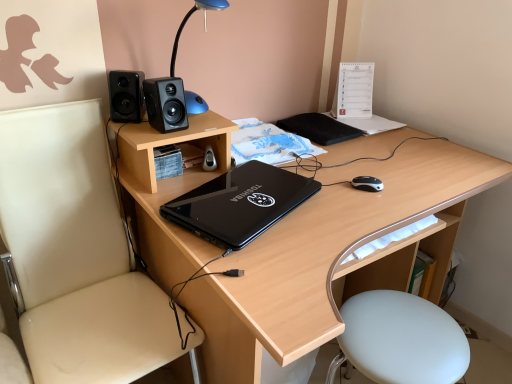
The width and height of the screenshot is (512, 384). Describe the element at coordinates (187, 20) in the screenshot. I see `blue glossy table lamp at upper center` at that location.

Identify the location of black plastic mouse at right. (367, 183).

What do you see at coordinates (400, 340) in the screenshot?
I see `white leather bar stool at lower right` at bounding box center [400, 340].

Describe the element at coordinates (126, 96) in the screenshot. This screenshot has height=384, width=512. I see `black matte speaker at upper left, arranged as the 2th speaker when viewed from the right` at that location.

You are a GUI agent. You are given a task and a screenshot of the screen. Output one action in this format:
    pyautogui.click(x=<x>, y=<y>)
    Task: Click on the beige leather chair at left
    This screenshot has height=384, width=512.
    Given the screenshot: What is the action you would take?
    pyautogui.click(x=75, y=253)

Is beige leather chair at left directly adjacent to black glossy laptop at center?

beige leather chair at left and black glossy laptop at center are not in contact.

From a real-world perspective, is beige leather chair at left on black glossy laptop at center?

No.

Which of these two, beige leather chair at left or black glossy laptop at center, is bigger?

With larger size is beige leather chair at left.

From the image's perspective, is beige leather chair at left below black glossy laptop at center?

Yes.

You are a GUI agent. You are given a task and a screenshot of the screen. Output one action in this format:
    pyautogui.click(x=<x>, y=<y>)
    Task: Click on the 1st speaker positioned above the beige leather chair at left (from the image's perspective)
    
    Given the screenshot: What is the action you would take?
    pyautogui.click(x=165, y=104)

Which is closer, (168, 98) or (39, 192)?

Point (168, 98) is closer to the camera than point (39, 192).

Is black matte speaker at upper center, arranged as the 2th speaker when viewed from the left, bigger than beige leather chair at left?

Actually, black matte speaker at upper center, arranged as the 2th speaker when viewed from the left, might be smaller than beige leather chair at left.

From the picture: Is beige leather chair at left taller or shorter than black matte speaker at upper center, arranged as the 2th speaker when viewed from the left?

beige leather chair at left is taller than black matte speaker at upper center, arranged as the 2th speaker when viewed from the left.

Does beige leather chair at left have a smaller size compared to black matte speaker at upper center, arranged as the 2th speaker when viewed from the left?

Actually, beige leather chair at left might be larger than black matte speaker at upper center, arranged as the 2th speaker when viewed from the left.

Is beige leather chair at left at the right side of black matte speaker at upper center, which appears as the first speaker when viewed from the right?

No.

This screenshot has height=384, width=512. Find the location of `chair that is below the black matte speaker at upper center, which appears as the first speaker when viewed from the right (from the image's perspective)`. chair that is below the black matte speaker at upper center, which appears as the first speaker when viewed from the right (from the image's perspective) is located at coordinates (75, 253).

Which is in front, black matte notepad at upper right or blue glossy table lamp at upper center?

blue glossy table lamp at upper center is in front.

Is black matte notepad at upper right turned away from blue glossy table lamp at upper center?

No, black matte notepad at upper right's orientation is not away from blue glossy table lamp at upper center.

There is a black matte notepad at upper right. At what (x,y) coordinates should I click in order to perform the action: click on table lamp above it (from a real-world perspective). Please return your answer as a coordinate pair (x, y). The height and width of the screenshot is (384, 512). Looking at the image, I should click on (187, 20).

Does black glossy laptop at center have a smaller size compared to black matte speaker at upper center, arranged as the 2th speaker when viewed from the left?

No, black glossy laptop at center is not smaller than black matte speaker at upper center, arranged as the 2th speaker when viewed from the left.

The image size is (512, 384). I want to click on laptop beneath the black matte speaker at upper center, which appears as the first speaker when viewed from the right (from a real-world perspective), so click(x=240, y=203).

Measure the distance from black glossy laptop at center to black matte speaker at upper center, arranged as the 2th speaker when viewed from the left.

black glossy laptop at center is 11.08 inches from black matte speaker at upper center, arranged as the 2th speaker when viewed from the left.

Considering the positions of objects black glossy laptop at center and black matte speaker at upper center, arranged as the 2th speaker when viewed from the left, in the image provided, who is more to the right, black glossy laptop at center or black matte speaker at upper center, arranged as the 2th speaker when viewed from the left,?

black glossy laptop at center is more to the right.

Are black plastic mouse at right and blue glossy table lamp at upper center beside each other?

black plastic mouse at right and blue glossy table lamp at upper center are not in contact.

Looking at this image, could you tell me if black plastic mouse at right is turned towards blue glossy table lamp at upper center?

No, black plastic mouse at right is not turned towards blue glossy table lamp at upper center.

Looking at this image, can you confirm if black plastic mouse at right is thinner than blue glossy table lamp at upper center?

Indeed, black plastic mouse at right has a lesser width compared to blue glossy table lamp at upper center.

From the image's perspective, between black plastic mouse at right and blue glossy table lamp at upper center, which one is located above?

blue glossy table lamp at upper center is shown above in the image.

Based on the photo, from the image's perspective, is black glossy laptop at center above blue glossy table lamp at upper center?

No, from the image's perspective, black glossy laptop at center is not above blue glossy table lamp at upper center.

Considering the relative sizes of black glossy laptop at center and blue glossy table lamp at upper center in the image provided, is black glossy laptop at center bigger than blue glossy table lamp at upper center?

Incorrect, black glossy laptop at center is not larger than blue glossy table lamp at upper center.

In the scene shown: Does black glossy laptop at center touch blue glossy table lamp at upper center?

No, black glossy laptop at center is not touching blue glossy table lamp at upper center.

Find the location of a particular element. laptop on the right of beige leather chair at left is located at coordinates coord(240,203).

From a real-world perspective, which speaker is the 2nd one above the beige leather chair at left? Please provide its 2D coordinates.

[(165, 104)]

Looking at the image, which one is located closer to black matte notepad at upper right, beige leather chair at left or black matte speaker at upper center, which appears as the first speaker when viewed from the right?

Among the two, black matte speaker at upper center, which appears as the first speaker when viewed from the right, is located nearer to black matte notepad at upper right.

Based on their spatial positions, is black matte notepad at upper right or white leather bar stool at lower right further from black matte speaker at upper center, arranged as the 2th speaker when viewed from the left?

Based on the image, white leather bar stool at lower right appears to be further to black matte speaker at upper center, arranged as the 2th speaker when viewed from the left.

Estimate the real-world distances between objects in this image. Which object is closer to beige leather chair at left, black plastic mouse at right or black glossy laptop at center?

The object closer to beige leather chair at left is black glossy laptop at center.

From the image, which object appears to be farther from black plastic mouse at right, black matte notepad at upper right or black glossy laptop at center?

black matte notepad at upper right.

Considering their positions, is black matte speaker at upper left, arranged as the 2th speaker when viewed from the right, positioned further to wooden desk at center than black matte speaker at upper center, arranged as the 2th speaker when viewed from the left?

Based on the image, black matte speaker at upper left, arranged as the 2th speaker when viewed from the right, appears to be further to wooden desk at center.

Considering their positions, is blue glossy table lamp at upper center positioned further to white leather bar stool at lower right than black glossy laptop at center?

Among the two, blue glossy table lamp at upper center is located further to white leather bar stool at lower right.

When comparing their distances from black matte speaker at upper center, which appears as the first speaker when viewed from the right, does beige leather chair at left or wooden desk at center seem further?

Based on the image, wooden desk at center appears to be further to black matte speaker at upper center, which appears as the first speaker when viewed from the right.

Estimate the real-world distances between objects in this image. Which object is closer to black matte speaker at upper left, acting as the 1th speaker starting from the left, black matte speaker at upper center, which appears as the first speaker when viewed from the right, or wooden desk at center?

black matte speaker at upper center, which appears as the first speaker when viewed from the right, lies closer to black matte speaker at upper left, acting as the 1th speaker starting from the left, than the other object.

Where is `table lamp between beige leather chair at left and black plastic mouse at right from left to right`? The height and width of the screenshot is (384, 512). table lamp between beige leather chair at left and black plastic mouse at right from left to right is located at coordinates (187, 20).

Locate an element on the screen. Image resolution: width=512 pixels, height=384 pixels. desk between black matte speaker at upper center, arranged as the 2th speaker when viewed from the left, and white leather bar stool at lower right in the up-down direction is located at coordinates (322, 256).

At what (x,y) coordinates should I click in order to perform the action: click on laptop between black matte speaker at upper left, acting as the 1th speaker starting from the left, and beige leather chair at left, in the vertical direction. Please return your answer as a coordinate pair (x, y). This screenshot has height=384, width=512. Looking at the image, I should click on (240, 203).

You are a GUI agent. You are given a task and a screenshot of the screen. Output one action in this format:
    pyautogui.click(x=<x>, y=<y>)
    Task: Click on the laptop that lies between black matte notepad at upper right and white leather bar stool at lower right from top to bottom
    Image resolution: width=512 pixels, height=384 pixels.
    Given the screenshot: What is the action you would take?
    pyautogui.click(x=240, y=203)